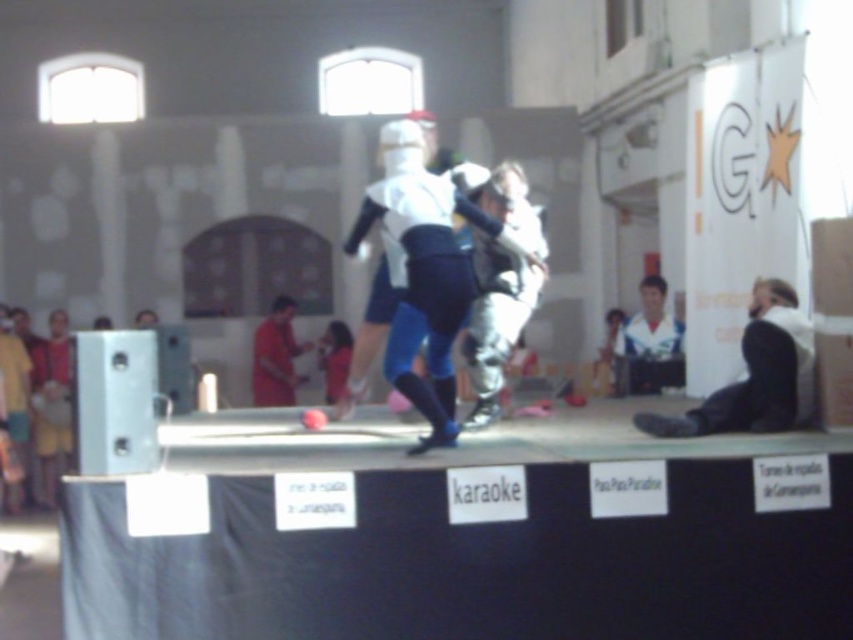
Question: Can you confirm if white matte helmet at center is positioned above orange matte shirt at center?

Choices:
 (A) yes
 (B) no

Answer: (A)

Question: Which point appears farthest from the camera in this image?

Choices:
 (A) (428, 179)
 (B) (265, 323)

Answer: (B)

Question: Is white matte helmet at center smaller than orange matte shirt at center?

Choices:
 (A) yes
 (B) no

Answer: (B)

Question: Among these objects, which one is nearest to the camera?

Choices:
 (A) white matte helmet at center
 (B) orange matte shirt at center

Answer: (A)

Question: In this image, where is white matte helmet at center located relative to orange matte shirt at center?

Choices:
 (A) left
 (B) right

Answer: (B)